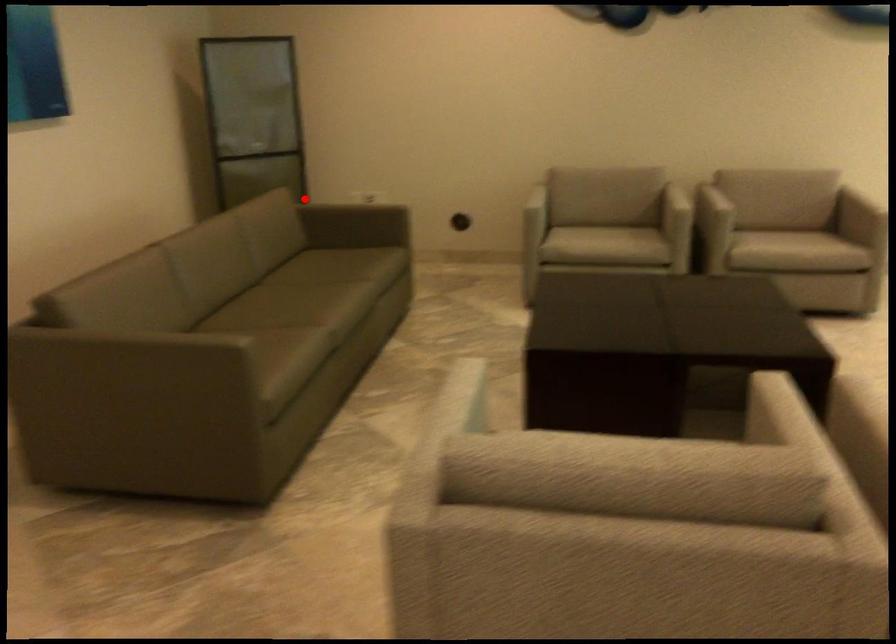
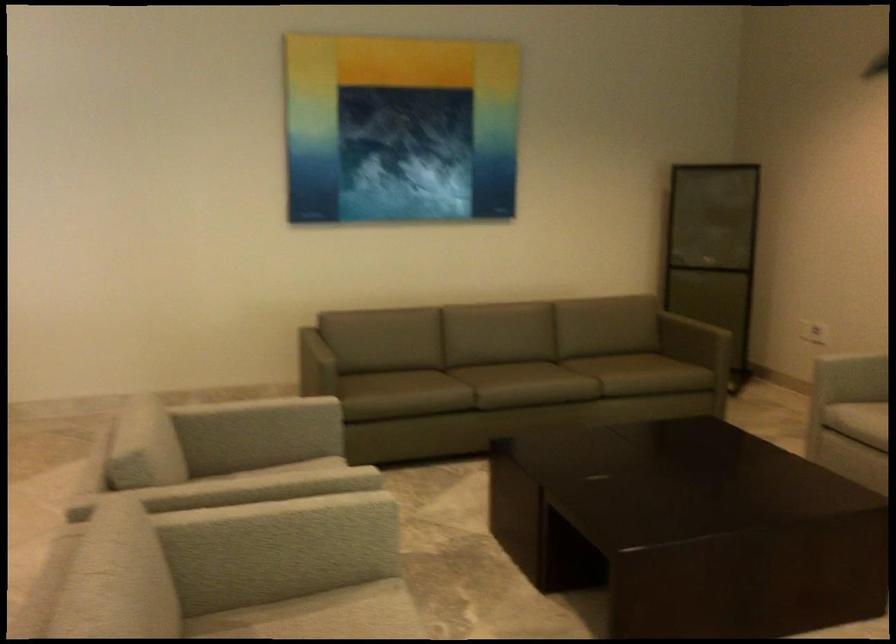
Where in the second image is the point corresponding to the highlighted location from the first image?

(713, 317)